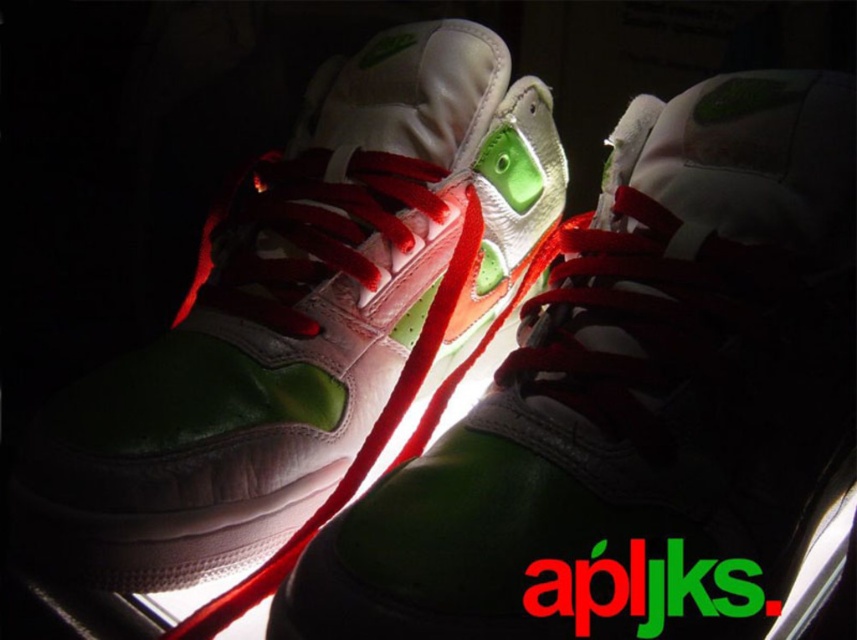
Question: Is green matte running shoe at center above matte white and green sneakers at center?

Choices:
 (A) yes
 (B) no

Answer: (B)

Question: Which object is closer to the camera taking this photo?

Choices:
 (A) green matte running shoe at center
 (B) matte white and green sneakers at center

Answer: (A)

Question: Does green matte running shoe at center have a lesser width compared to matte white and green sneakers at center?

Choices:
 (A) no
 (B) yes

Answer: (B)

Question: Is green matte running shoe at center in front of matte white and green sneakers at center?

Choices:
 (A) yes
 (B) no

Answer: (A)

Question: Among these points, which one is nearest to the camera?

Choices:
 (A) (169, 570)
 (B) (808, 352)

Answer: (B)